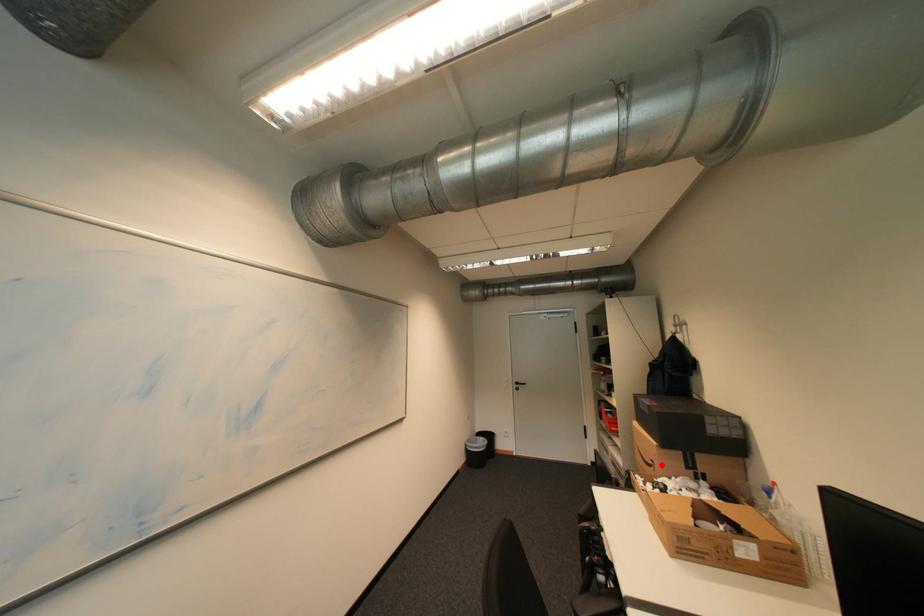
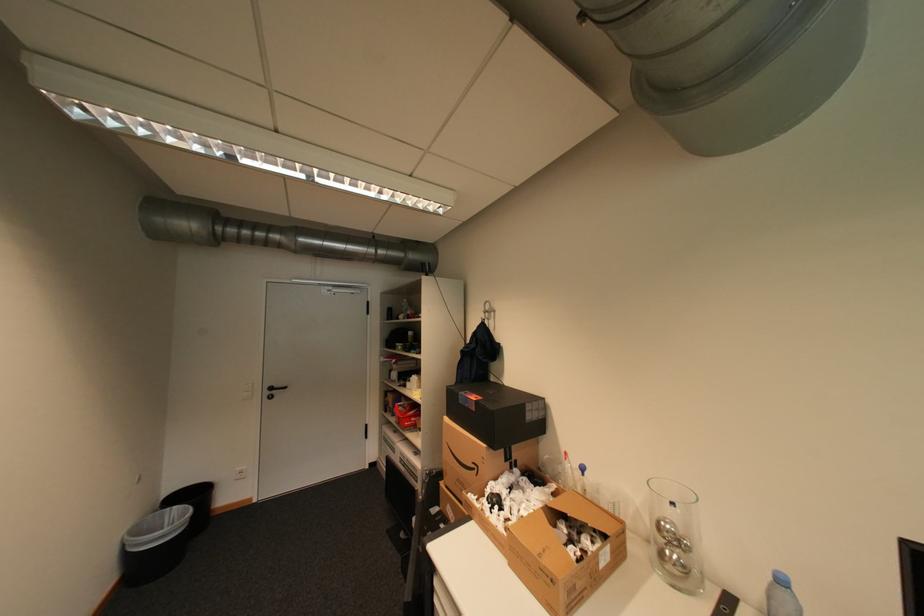
Question: I am providing you with two images of the same scene from different viewpoints. In image1, a red point is highlighted. Considering the same 3D point in image2, which of the following is correct?

Choices:
 (A) It is closer
 (B) It is farther

Answer: (B)